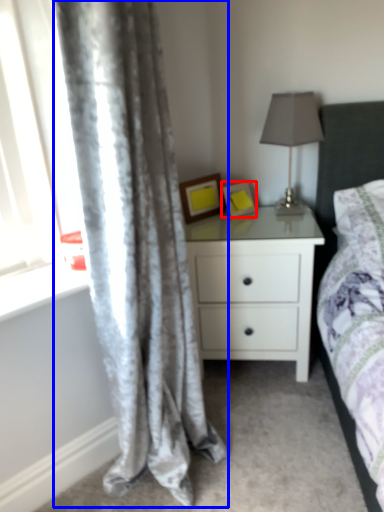
Question: Among these objects, which one is farthest to the camera, picture frame (highlighted by a red box) or curtain (highlighted by a blue box)?

Choices:
 (A) picture frame
 (B) curtain

Answer: (A)